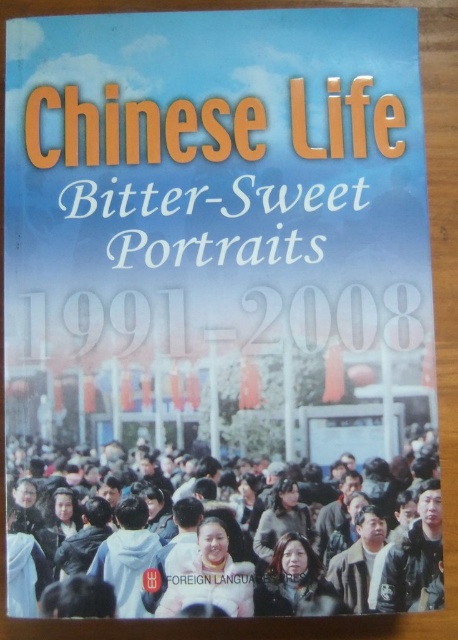
Question: Which object is closer to the camera taking this photo?

Choices:
 (A) dark brown hair at center
 (B) matte paper book at center

Answer: (A)

Question: Can you confirm if matte paper book at center is positioned above dark brown hair at center?

Choices:
 (A) yes
 (B) no

Answer: (A)

Question: Which point is closer to the camera?

Choices:
 (A) (383, 573)
 (B) (285, 356)

Answer: (A)

Question: Is matte paper book at center thinner than dark brown hair at center?

Choices:
 (A) no
 (B) yes

Answer: (A)

Question: Can you confirm if matte paper book at center is positioned below dark brown hair at center?

Choices:
 (A) no
 (B) yes

Answer: (A)